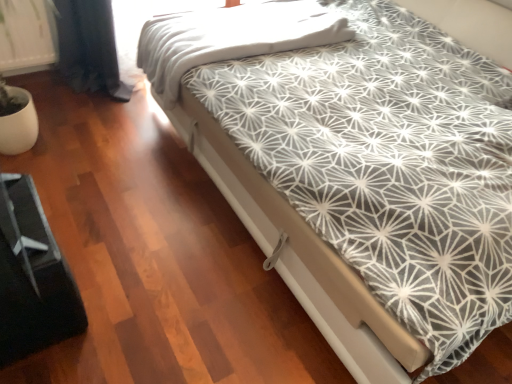
Measure the distance between white textured blanket at upper center and camera.

They are 5.78 feet apart.

Image resolution: width=512 pixels, height=384 pixels. Describe the element at coordinates (371, 183) in the screenshot. I see `white geometric-patterned bed at center` at that location.

Identify the location of white textured blanket at upper center. (230, 38).

Is white textured blanket at upper center completely or partially outside of white geometric-patterned bed at center?

Actually, white textured blanket at upper center is at least partially inside white geometric-patterned bed at center.

From a real-world perspective, is white textured blanket at upper center below white geometric-patterned bed at center?

Correct, in the physical world, white textured blanket at upper center is lower than white geometric-patterned bed at center.

Is white textured blanket at upper center positioned behind white geometric-patterned bed at center?

Yes, white textured blanket at upper center is further from the viewer.

Looking at this image, from a real-world perspective, is white textured blanket at upper center positioned under black plastic bed frame at lower left based on gravity?

No, from a real-world perspective, white textured blanket at upper center is not below black plastic bed frame at lower left.

Which is in front, point (245, 54) or point (48, 231)?

The point (48, 231) is closer to the camera.

The height and width of the screenshot is (384, 512). In order to click on bed frame below the white textured blanket at upper center (from the image's perspective) in this screenshot , I will do [x=32, y=277].

Is black plastic bed frame at lower left completely or partially inside white textured blanket at upper center?

No, white textured blanket at upper center does not contain black plastic bed frame at lower left.

How different are the orientations of black plastic bed frame at lower left and white geometric-patterned bed at center in degrees?

The angular difference between black plastic bed frame at lower left and white geometric-patterned bed at center is 177 degrees.

Is white geometric-patterned bed at center at the back of black plastic bed frame at lower left?

No.

Can you confirm if black plastic bed frame at lower left is wider than white geometric-patterned bed at center?

No, black plastic bed frame at lower left is not wider than white geometric-patterned bed at center.

Is point (45, 273) positioned in front of point (247, 123)?

Yes, point (45, 273) is closer to viewer.

Between black plastic bed frame at lower left and white textured blanket at upper center, which one has larger width?

white textured blanket at upper center.

Does black plastic bed frame at lower left have a lesser height compared to white textured blanket at upper center?

No.

From a real-world perspective, is black plastic bed frame at lower left on top of white textured blanket at upper center?

No.

Does black plastic bed frame at lower left touch white textured blanket at upper center?

No, black plastic bed frame at lower left is not in contact with white textured blanket at upper center.

Could you tell me if white geometric-patterned bed at center is turned towards black plastic bed frame at lower left?

Yes, white geometric-patterned bed at center is turned towards black plastic bed frame at lower left.

What's the angular difference between white geometric-patterned bed at center and black plastic bed frame at lower left's facing directions?

They differ by 177 degrees in their facing directions.

Is white geometric-patterned bed at center positioned beyond the bounds of black plastic bed frame at lower left?

white geometric-patterned bed at center is positioned outside black plastic bed frame at lower left.

Could you measure the distance between white geometric-patterned bed at center and black plastic bed frame at lower left?

36.88 inches.

Consider the image. Which is further, (490, 177) or (206, 49)?

Point (206, 49)

Between white geometric-patterned bed at center and white textured blanket at upper center, which one is positioned behind?

white textured blanket at upper center is further away from the camera.

Is white textured blanket at upper center inside white geometric-patterned bed at center?

Yes, white geometric-patterned bed at center contains white textured blanket at upper center.

The height and width of the screenshot is (384, 512). In order to click on bed in front of the white textured blanket at upper center in this screenshot , I will do click(371, 183).

I want to click on bed frame below the white textured blanket at upper center (from a real-world perspective), so click(x=32, y=277).

From the image, which object appears to be nearer to white textured blanket at upper center, black plastic bed frame at lower left or white geometric-patterned bed at center?

white geometric-patterned bed at center lies closer to white textured blanket at upper center than the other object.

When comparing their distances from white geometric-patterned bed at center, does black plastic bed frame at lower left or white textured blanket at upper center seem further?

Based on the image, black plastic bed frame at lower left appears to be further to white geometric-patterned bed at center.

Which object lies nearer to the anchor point black plastic bed frame at lower left, white textured blanket at upper center or white geometric-patterned bed at center?

The object closer to black plastic bed frame at lower left is white geometric-patterned bed at center.

When comparing their distances from white geometric-patterned bed at center, does white textured blanket at upper center or black plastic bed frame at lower left seem further?

black plastic bed frame at lower left lies further to white geometric-patterned bed at center than the other object.

From the image, which object appears to be nearer to white textured blanket at upper center, white geometric-patterned bed at center or black plastic bed frame at lower left?

white geometric-patterned bed at center is closer to white textured blanket at upper center.

Considering their positions, is white geometric-patterned bed at center positioned further to black plastic bed frame at lower left than white textured blanket at upper center?

white textured blanket at upper center.

Where is `blanket between black plastic bed frame at lower left and white geometric-patterned bed at center in the horizontal direction`? blanket between black plastic bed frame at lower left and white geometric-patterned bed at center in the horizontal direction is located at coordinates (230, 38).